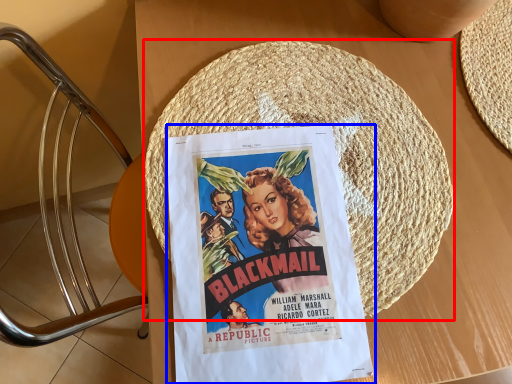
Question: Which object appears farthest to the camera in this image, straw hat (highlighted by a red box) or poster (highlighted by a blue box)?

Choices:
 (A) straw hat
 (B) poster

Answer: (A)